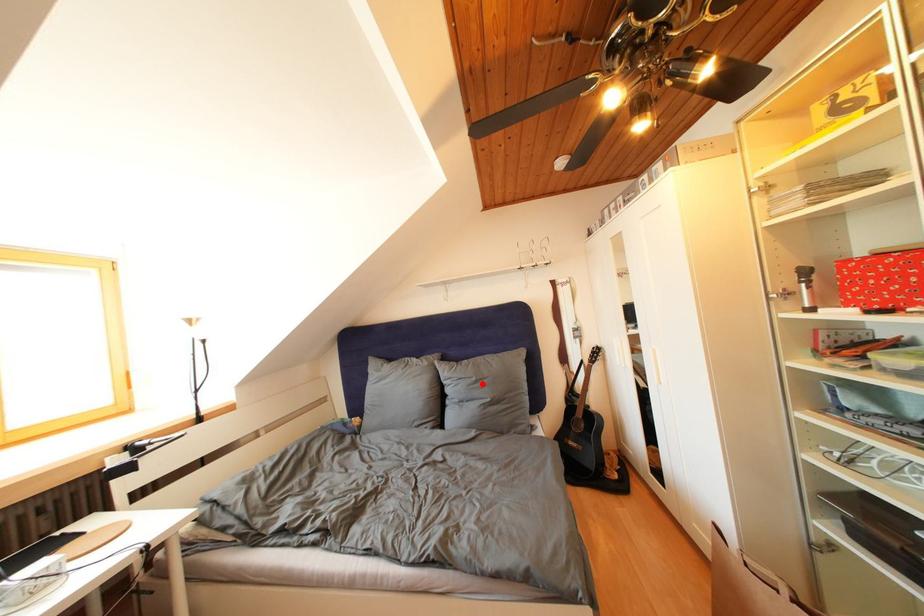
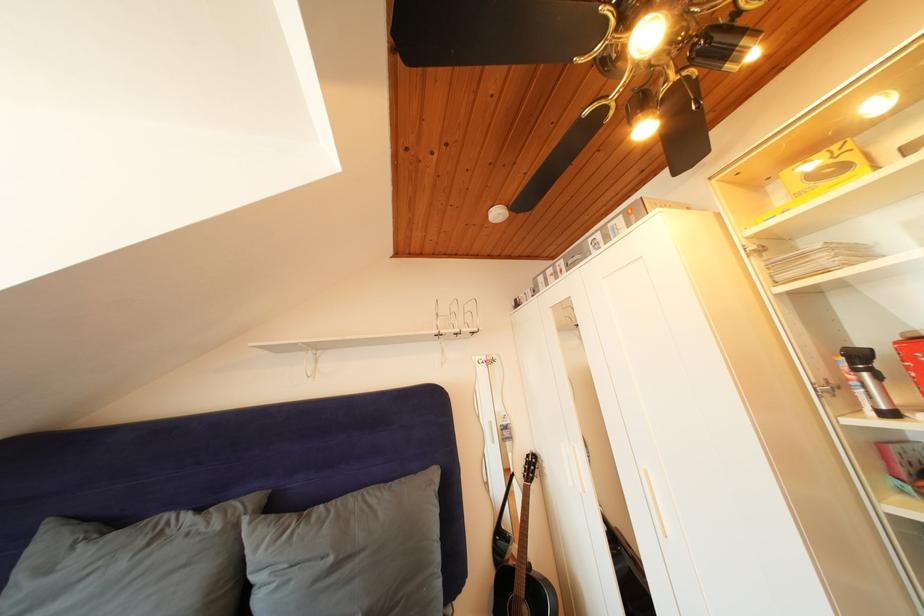
In the second image, find the point that corresponds to the highlighted location in the first image.

(338, 565)